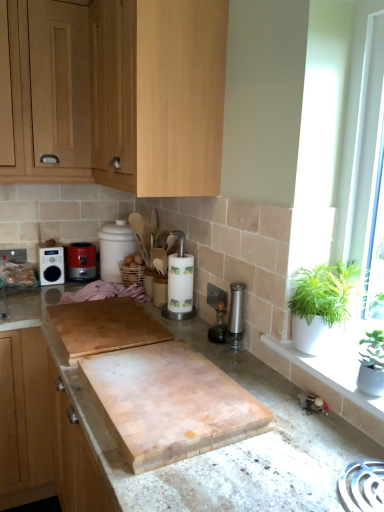
Question: Can you confirm if green leafy plant at right, the first houseplant positioned from the back, is bigger than white wooden frame at right?

Choices:
 (A) yes
 (B) no

Answer: (B)

Question: From the image's perspective, is green leafy plant at right, the second houseplant when ordered from front to back, below white wooden frame at right?

Choices:
 (A) no
 (B) yes

Answer: (B)

Question: Is green leafy plant at right, the second houseplant when ordered from front to back, turned away from white wooden frame at right?

Choices:
 (A) no
 (B) yes

Answer: (B)

Question: Is green leafy plant at right, the second houseplant when ordered from front to back, facing towards white wooden frame at right?

Choices:
 (A) no
 (B) yes

Answer: (A)

Question: Does green leafy plant at right, the first houseplant positioned from the back, have a smaller size compared to white wooden frame at right?

Choices:
 (A) yes
 (B) no

Answer: (A)

Question: From a real-world perspective, does green leafy plant at right, the first houseplant positioned from the back, sit lower than white wooden frame at right?

Choices:
 (A) no
 (B) yes

Answer: (B)

Question: From a real-world perspective, is light wood cabinet at upper left, the 2th cabinetry positioned from the bottom, located beneath light wood cabinet at left, the third cabinetry when ordered from top to bottom?

Choices:
 (A) yes
 (B) no

Answer: (B)

Question: Is light wood cabinet at upper left, which appears as the second cabinetry when viewed from the top, in contact with light wood cabinet at left, the first cabinetry from the bottom?

Choices:
 (A) yes
 (B) no

Answer: (B)

Question: Does light wood cabinet at upper left, the 2th cabinetry positioned from the bottom, have a lesser width compared to light wood cabinet at left, the third cabinetry when ordered from top to bottom?

Choices:
 (A) no
 (B) yes

Answer: (A)

Question: Does light wood cabinet at upper left, the 2th cabinetry positioned from the bottom, come behind light wood cabinet at left, the third cabinetry when ordered from top to bottom?

Choices:
 (A) no
 (B) yes

Answer: (A)

Question: From a real-world perspective, is light wood cabinet at upper left, the 2th cabinetry positioned from the bottom, located higher than light wood cabinet at left, the first cabinetry from the bottom?

Choices:
 (A) no
 (B) yes

Answer: (B)

Question: Is light wood cabinet at upper left, the 2th cabinetry positioned from the bottom, far from light wood cabinet at left, the first cabinetry from the bottom?

Choices:
 (A) no
 (B) yes

Answer: (A)

Question: Is light wood cabinet at left, the first cabinetry from the bottom, looking in the opposite direction of white wooden frame at right?

Choices:
 (A) yes
 (B) no

Answer: (B)